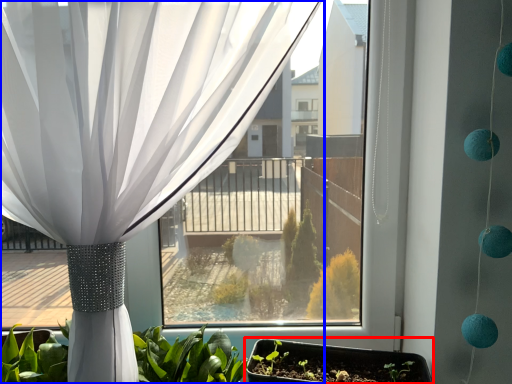
Question: Which object is closer to the camera taking this photo, flowerpot (highlighted by a red box) or curtain (highlighted by a blue box)?

Choices:
 (A) flowerpot
 (B) curtain

Answer: (B)